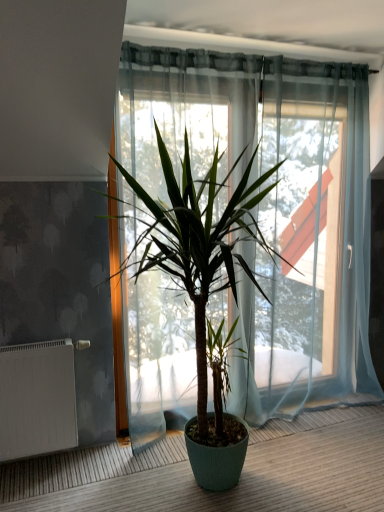
Question: Can you confirm if green matte plant at center is shorter than white matte radiator at lower left?

Choices:
 (A) no
 (B) yes

Answer: (A)

Question: From the image's perspective, is green matte plant at center beneath white matte radiator at lower left?

Choices:
 (A) yes
 (B) no

Answer: (B)

Question: From a real-world perspective, is green matte plant at center on white matte radiator at lower left?

Choices:
 (A) no
 (B) yes

Answer: (B)

Question: Is the position of green matte plant at center less distant than that of white matte radiator at lower left?

Choices:
 (A) no
 (B) yes

Answer: (B)

Question: Is green matte plant at center oriented towards white matte radiator at lower left?

Choices:
 (A) no
 (B) yes

Answer: (A)

Question: Is white matte radiator at lower left at the back of green matte plant at center?

Choices:
 (A) no
 (B) yes

Answer: (A)

Question: Considering the relative positions of white matte radiator at lower left and green matte plant at center in the image provided, is white matte radiator at lower left in front of green matte plant at center?

Choices:
 (A) no
 (B) yes

Answer: (A)

Question: Does white matte radiator at lower left have a larger size compared to green matte plant at center?

Choices:
 (A) yes
 (B) no

Answer: (B)

Question: Can you confirm if white matte radiator at lower left is taller than green matte plant at center?

Choices:
 (A) no
 (B) yes

Answer: (A)

Question: From a real-world perspective, is white matte radiator at lower left over green matte plant at center?

Choices:
 (A) no
 (B) yes

Answer: (A)

Question: Is white matte radiator at lower left thinner than green matte plant at center?

Choices:
 (A) yes
 (B) no

Answer: (A)

Question: Is white matte radiator at lower left at the right side of green matte plant at center?

Choices:
 (A) yes
 (B) no

Answer: (B)

Question: Is white matte radiator at lower left inside the boundaries of green matte plant at center, or outside?

Choices:
 (A) inside
 (B) outside

Answer: (B)